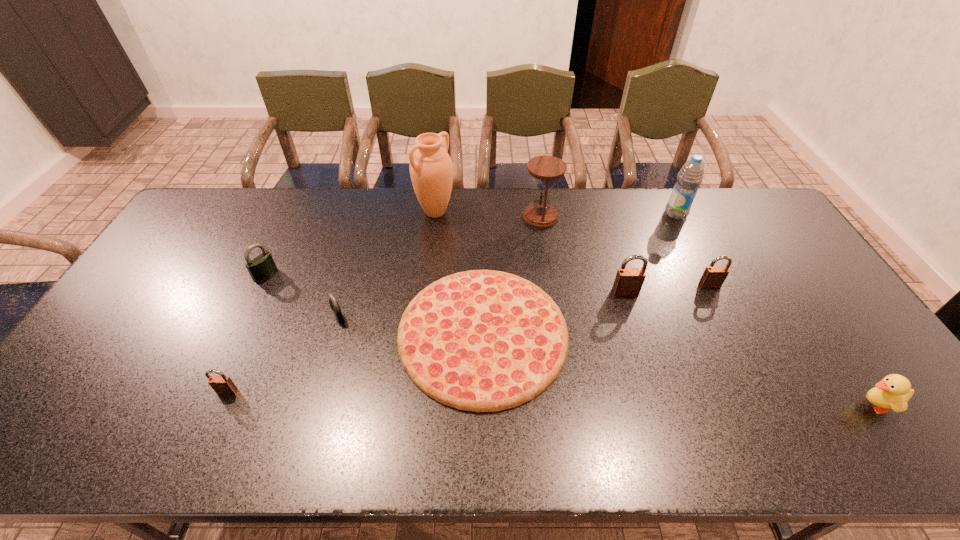
Identify which padlock is the closest to the pizza. Please provide its 2D coordinates. Your answer should be formatted as a tuple, i.e. [(x, y)], where the tuple contains the x and y coordinates of a point satisfying the conditions above.

[(335, 307)]

Where is `brown padlock that is the second closest to the blue water bottle`? This screenshot has width=960, height=540. brown padlock that is the second closest to the blue water bottle is located at coordinates click(628, 282).

Locate which brown padlock is the second closest to the shortest object. Please provide its 2D coordinates. Your answer should be formatted as a tuple, i.e. [(x, y)], where the tuple contains the x and y coordinates of a point satisfying the conditions above.

[(222, 384)]